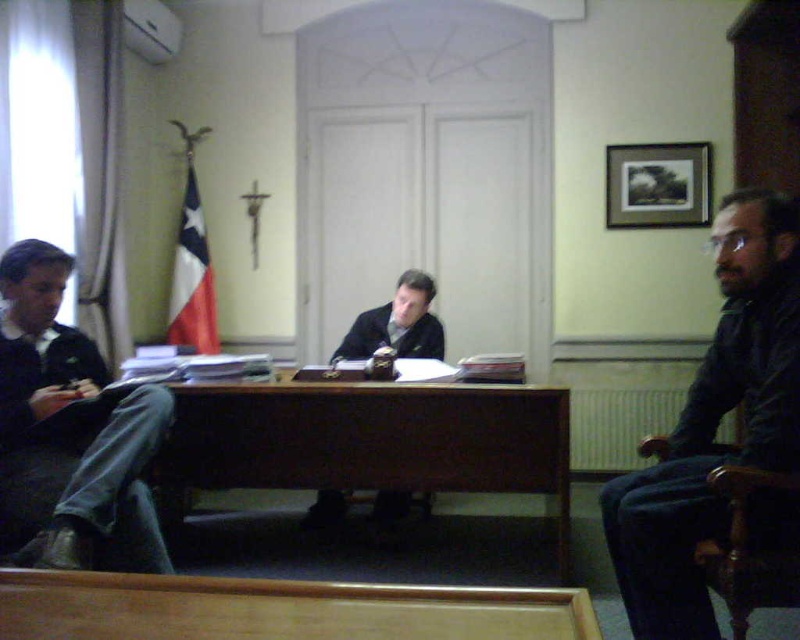
You are organizing a meeting in this room and need to place a rectangular box that is 1 meter wide between the wooden chair at right and the dark brown leather shoes at center. Based on their widths, will the box fit between them?

The wooden chair at right has a lesser width compared to dark brown leather shoes at center. Since the box is 1 meter wide, it depends on the actual distance between them, but the description only mentions their widths, not the space between. Therefore, the information provided is insufficient to determine if the box will fit.

You are organizing a photo shoot and need to ensure that the dark blue shirt at right and the dark blue jeans at left are visible in the frame. Given their sizes, which one might require more space in the composition?

The dark blue jeans at left require more space in the composition because they are wider than the dark blue shirt at right.

You are standing in the meeting room and want to determine which of the two points, point (310, 472) or point (360, 349), is closer to you. Based on the scene description, which point is nearer?

Point (310, 472) is closer to the viewer than point (360, 349).